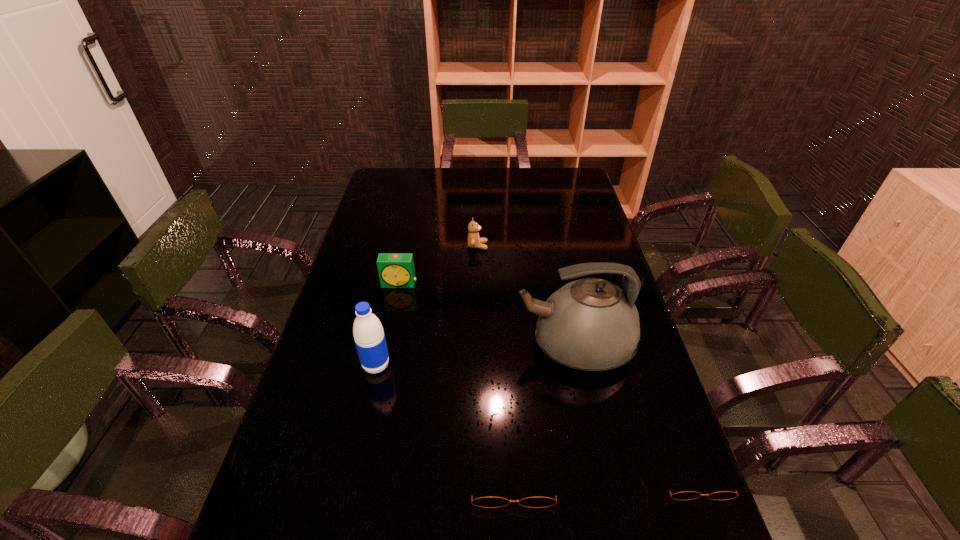
You are a GUI agent. You are given a task and a screenshot of the screen. Output one action in this format:
    pyautogui.click(x=<x>, y=<y>)
    Task: Click on the free location located 0.180m at the spout of the tallest object
    
    Given the screenshot: What is the action you would take?
    pyautogui.click(x=451, y=345)

Identify the location of vacant space situated 0.200m at the spout of the tallest object. (444, 345).

At what (x,y) coordinates should I click in order to perform the action: click on blank space located on the right of the water bottle. Please return your answer as a coordinate pair (x, y). The height and width of the screenshot is (540, 960). Looking at the image, I should click on (445, 366).

You are a GUI agent. You are given a task and a screenshot of the screen. Output one action in this format:
    pyautogui.click(x=<x>, y=<y>)
    Task: Click on the free spot located 0.220m on the front-facing side of the teddy bear
    This screenshot has height=540, width=960.
    Given the screenshot: What is the action you would take?
    pyautogui.click(x=548, y=246)

Locate an element on the screen. alarm clock located at the left edge is located at coordinates click(x=396, y=270).

Find the location of a particular element. water bottle situated at the left edge is located at coordinates (369, 337).

Identify the location of sunglasses situated at the right edge. (687, 495).

The width and height of the screenshot is (960, 540). In order to click on kettle located in the right edge section of the desktop in this screenshot , I will do `click(590, 324)`.

This screenshot has height=540, width=960. In order to click on object that is at the near right corner in this screenshot , I will do `click(687, 495)`.

Where is `vacant region at the far edge`? vacant region at the far edge is located at coordinates (418, 184).